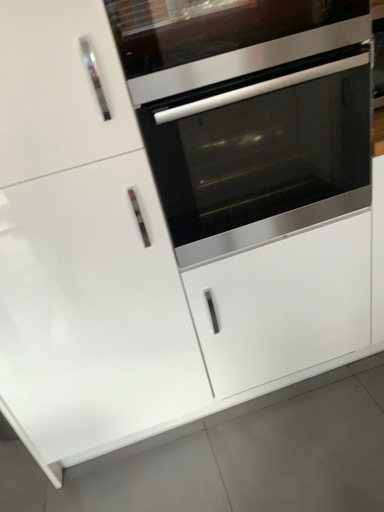
Question: Is stainless steel oven at center not near white glossy door at center?

Choices:
 (A) yes
 (B) no

Answer: (B)

Question: Is stainless steel oven at center beside white glossy door at center?

Choices:
 (A) yes
 (B) no

Answer: (B)

Question: From the image's perspective, is stainless steel oven at center located above white glossy door at center?

Choices:
 (A) no
 (B) yes

Answer: (B)

Question: From a real-world perspective, is stainless steel oven at center on top of white glossy door at center?

Choices:
 (A) yes
 (B) no

Answer: (A)

Question: Does stainless steel oven at center appear on the right side of white glossy door at center?

Choices:
 (A) no
 (B) yes

Answer: (B)

Question: Is stainless steel oven at center positioned beyond the bounds of white glossy door at center?

Choices:
 (A) no
 (B) yes

Answer: (B)

Question: Does white glossy drawer at center appear on the right side of stainless steel oven at center?

Choices:
 (A) no
 (B) yes

Answer: (B)

Question: From the image's perspective, is white glossy drawer at center beneath stainless steel oven at center?

Choices:
 (A) no
 (B) yes

Answer: (B)

Question: Is white glossy drawer at center further to the viewer compared to stainless steel oven at center?

Choices:
 (A) no
 (B) yes

Answer: (B)

Question: Is white glossy drawer at center positioned beyond the bounds of stainless steel oven at center?

Choices:
 (A) no
 (B) yes

Answer: (B)

Question: From a real-world perspective, is white glossy drawer at center physically above stainless steel oven at center?

Choices:
 (A) no
 (B) yes

Answer: (A)

Question: Is stainless steel oven at center at the back of white glossy drawer at center?

Choices:
 (A) yes
 (B) no

Answer: (B)

Question: Is stainless steel oven at center behind white glossy drawer at center?

Choices:
 (A) yes
 (B) no

Answer: (B)